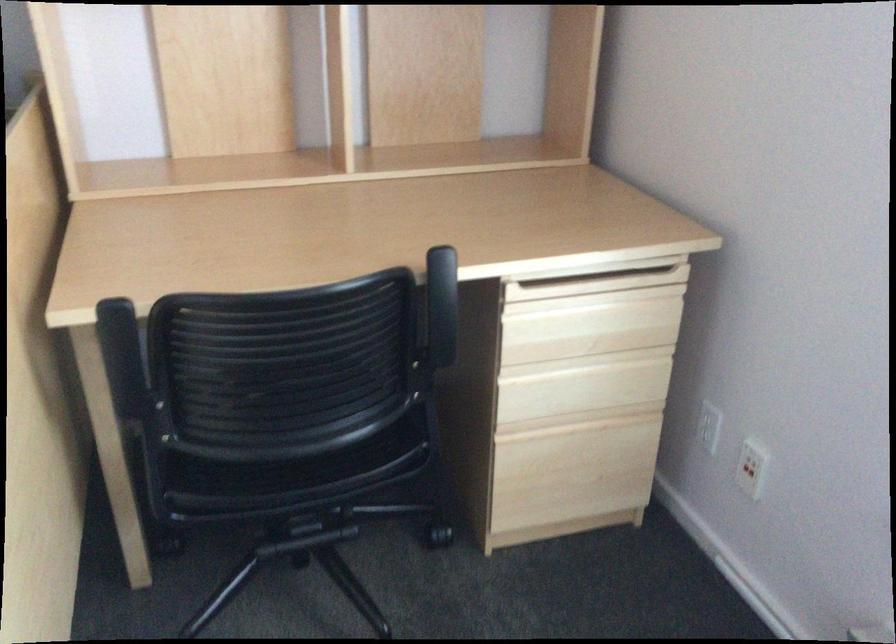
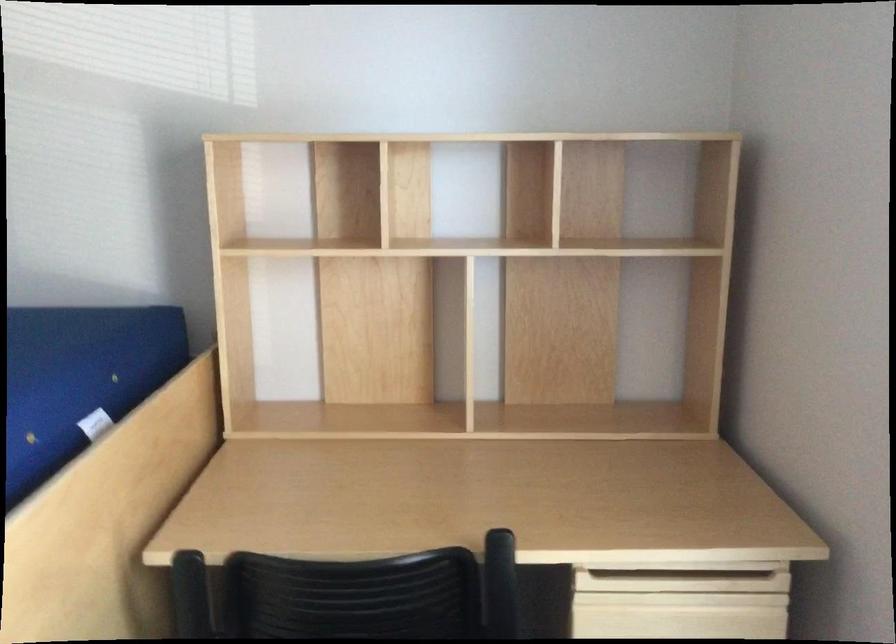
Question: Based on the continuous images, in which direction is the camera rotating? Reply with the corresponding letter.

Choices:
 (A) Left
 (B) Right
 (C) Up
 (D) Down

Answer: (A)